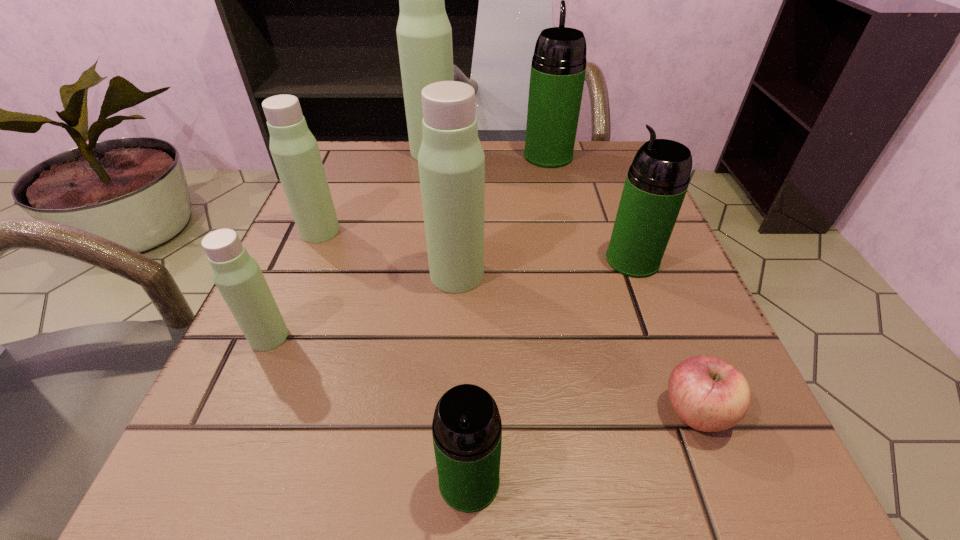
At what (x,y) coordinates should I click in order to perform the action: click on the biggest light thermos bottle. Please return your answer as a coordinate pair (x, y). This screenshot has width=960, height=540. Looking at the image, I should click on (424, 35).

Locate an element on the screen. the farthest light thermos bottle is located at coordinates (424, 35).

Where is `the farthest green thermos bottle`? the farthest green thermos bottle is located at coordinates (558, 68).

Find the location of `the sixth thermos bottle from left to right`. the sixth thermos bottle from left to right is located at coordinates (558, 68).

Identify the location of the second nearest light thermos bottle. (451, 161).

Where is `the second smallest light thermos bottle`? the second smallest light thermos bottle is located at coordinates (294, 149).

What are the coordinates of `the rightmost thermos bottle` in the screenshot? It's located at (657, 181).

This screenshot has width=960, height=540. Find the location of `the rightmost green thermos bottle`. the rightmost green thermos bottle is located at coordinates (657, 181).

I want to click on the sixth farthest thermos bottle, so click(x=237, y=275).

In order to click on the nearest light thermos bottle in this screenshot , I will do `click(237, 275)`.